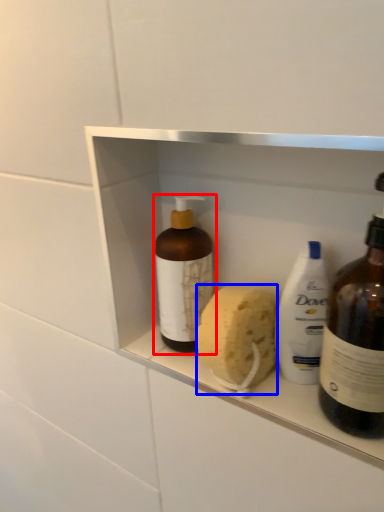
Question: Which point is further to the camera, bottle (highlighted by a red box) or soap (highlighted by a blue box)?

Choices:
 (A) bottle
 (B) soap

Answer: (A)